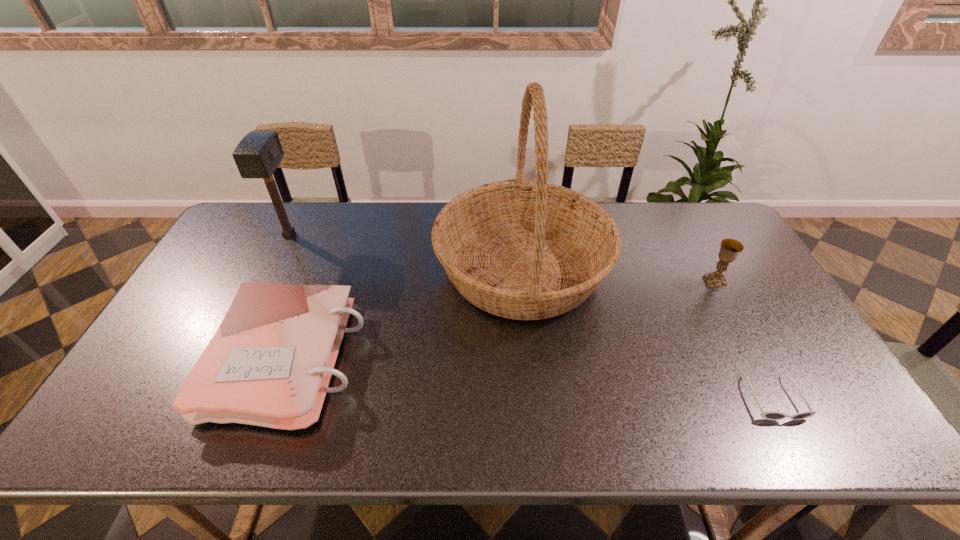
Identify the location of free space at the right edge of the desktop. This screenshot has width=960, height=540. (761, 354).

Locate an element on the screen. This screenshot has height=540, width=960. free space at the far left corner is located at coordinates [x=259, y=237].

Identify the location of empty space that is in between the shortest object and the fourth tallest object. (531, 379).

You are a GUI agent. You are given a task and a screenshot of the screen. Output one action in this format:
    pyautogui.click(x=<x>, y=<y>)
    Task: Click on the free space between the basket and the shortest object
    This screenshot has height=540, width=960.
    Given the screenshot: What is the action you would take?
    pyautogui.click(x=647, y=334)

Image resolution: width=960 pixels, height=540 pixels. I want to click on empty space between the third object from right to left and the shortest object, so click(647, 334).

Identify the location of free point between the shortest object and the fourth tallest object. Image resolution: width=960 pixels, height=540 pixels. (531, 379).

At what (x,y) coordinates should I click in order to perform the action: click on vacant area that lies between the basket and the chalice. Please return your answer as a coordinate pair (x, y). Looking at the image, I should click on coord(618,275).

Locate an element on the screen. The image size is (960, 540). vacant space that's between the chalice and the phonebook is located at coordinates (502, 320).

I want to click on unoccupied position between the third tallest object and the phonebook, so click(x=502, y=320).

At what (x,y) coordinates should I click in order to perform the action: click on free space between the phonebook and the basket. Please return your answer as a coordinate pair (x, y). The height and width of the screenshot is (540, 960). Looking at the image, I should click on (406, 314).